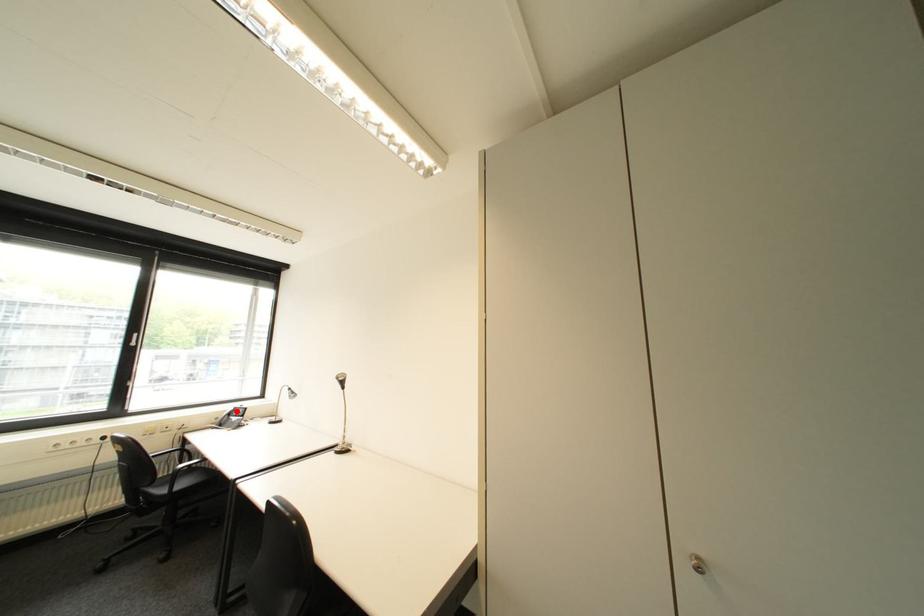
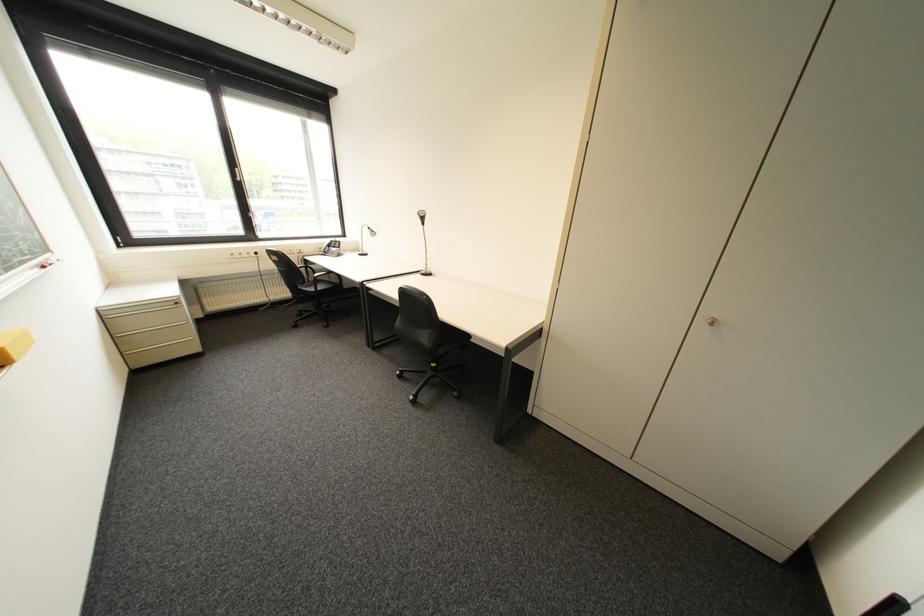
Question: I am providing you with two images of the same scene from different viewpoints. In image1, a red point is highlighted. Considering the same 3D point in image2, which of the following is correct?

Choices:
 (A) It is closer
 (B) It is farther

Answer: (A)